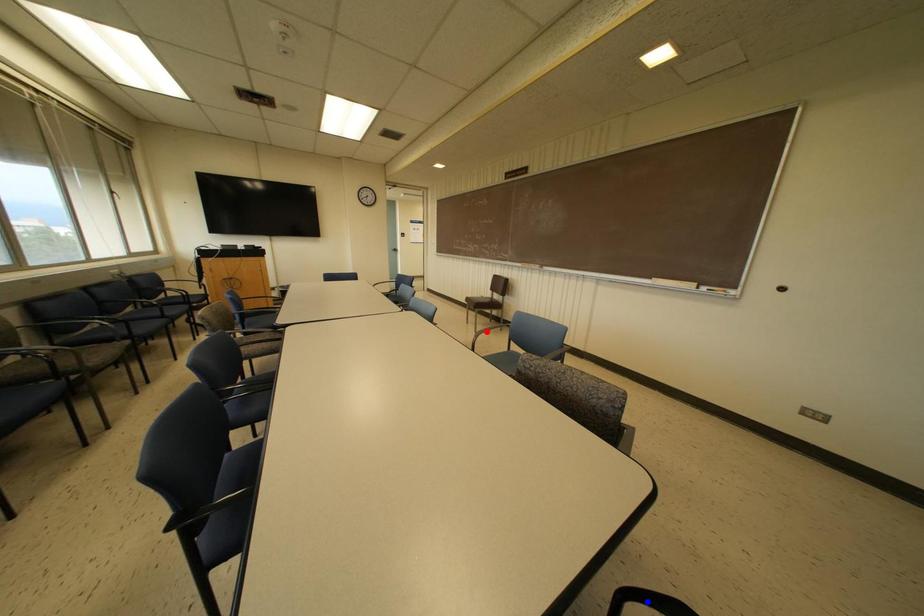
Question: Two points are marked on the image. Which point is closer to the camera?

Choices:
 (A) Blue point is closer.
 (B) Red point is closer.

Answer: (A)